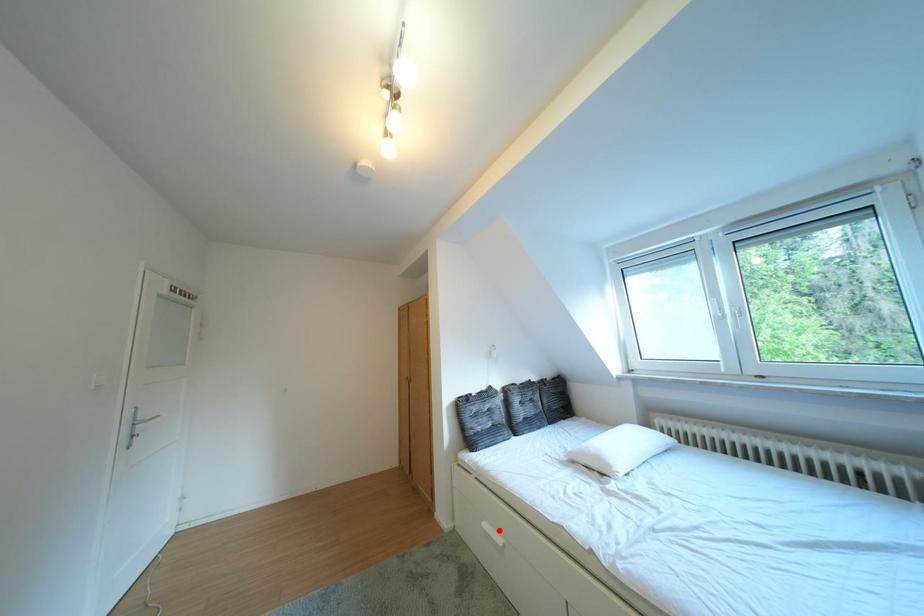
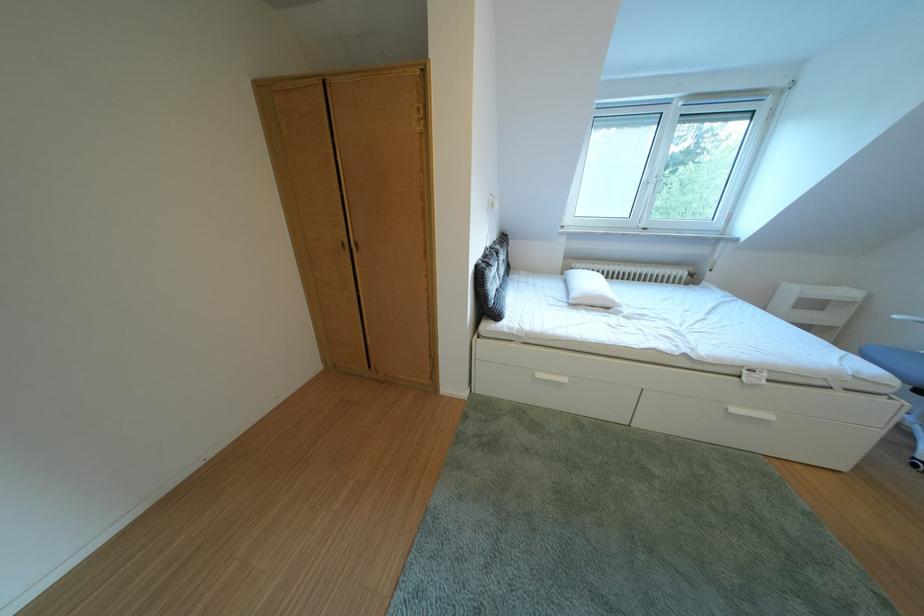
Question: I am providing you with two images of the same scene from different viewpoints. A red point is shown in image1. For the corresponding object point in image2, is it positioned nearer or farther from the camera?

Choices:
 (A) Nearer
 (B) Farther

Answer: (A)